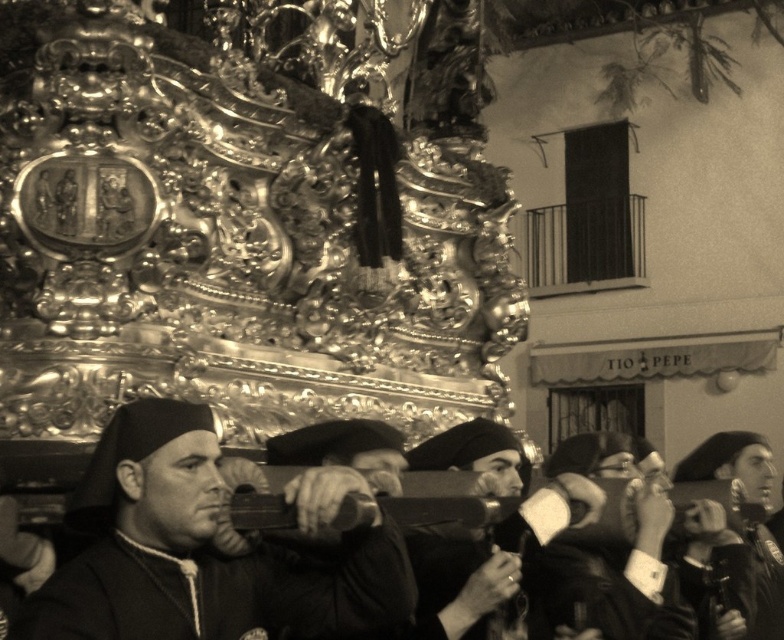
Question: Is smooth black robe at center to the right of smooth black hat at center from the viewer's perspective?

Choices:
 (A) no
 (B) yes

Answer: (A)

Question: Which of these objects is positioned closest to the smooth black hat at center?

Choices:
 (A) smooth black robe at center
 (B) leather jacket at center

Answer: (B)

Question: Which point appears farthest from the camera in this image?

Choices:
 (A) (82, 552)
 (B) (666, 630)
 (C) (731, 445)

Answer: (C)

Question: Is smooth black robe at center in front of leather jacket at center?

Choices:
 (A) no
 (B) yes

Answer: (B)

Question: Which object appears farthest from the camera in this image?

Choices:
 (A) leather jacket at center
 (B) smooth black hat at center
 (C) smooth black robe at center

Answer: (B)

Question: Considering the relative positions of smooth black robe at center and smooth black hat at center in the image provided, where is smooth black robe at center located with respect to smooth black hat at center?

Choices:
 (A) above
 (B) below

Answer: (A)